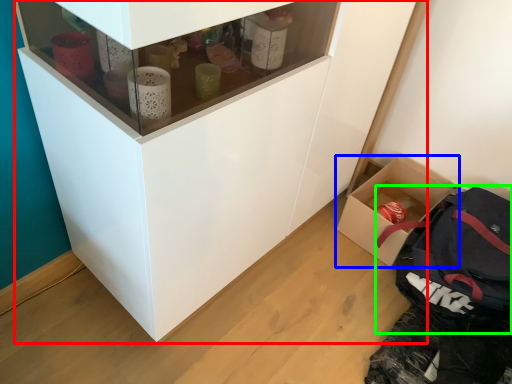
Question: Which object is positioned closest to cupboard (highlighted by a red box)? Select from box (highlighted by a blue box) and backpack (highlighted by a green box).

Choices:
 (A) box
 (B) backpack

Answer: (B)